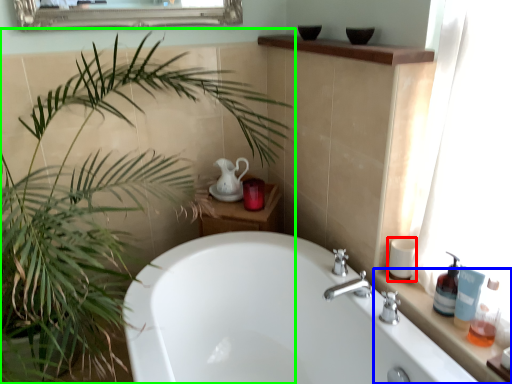
Question: Considering the real-world distances, which object is closest to toiletry (highlighted by a red box)? counter top (highlighted by a blue box) or houseplant (highlighted by a green box).

Choices:
 (A) counter top
 (B) houseplant

Answer: (A)